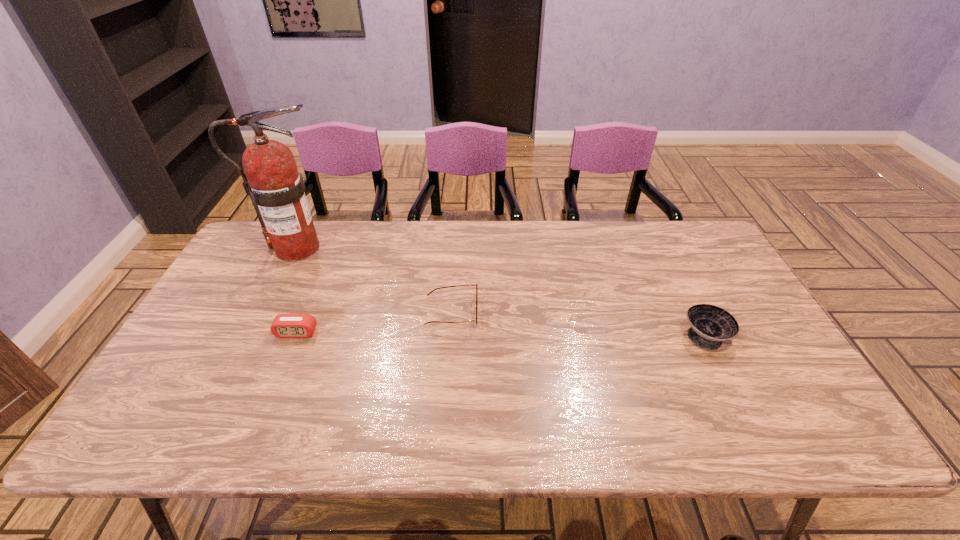
Locate an element on the screen. The image size is (960, 540). object present at the left edge is located at coordinates (277, 190).

Where is `object located at the right edge`? The height and width of the screenshot is (540, 960). object located at the right edge is located at coordinates pyautogui.click(x=710, y=325).

The width and height of the screenshot is (960, 540). Find the location of `object that is at the far left corner`. object that is at the far left corner is located at coordinates (277, 190).

Find the location of a particular element. The image size is (960, 540). free location at the far edge is located at coordinates (379, 247).

This screenshot has height=540, width=960. What are the coordinates of `free location at the near edge` in the screenshot? It's located at (206, 436).

You are a GUI agent. You are given a task and a screenshot of the screen. Output one action in this format:
    pyautogui.click(x=<x>, y=<y>)
    Task: Click on the vacant space at the left edge of the desktop
    This screenshot has width=960, height=540.
    Given the screenshot: What is the action you would take?
    pyautogui.click(x=195, y=322)

Where is `vacant space at the far right corner of the desktop`? vacant space at the far right corner of the desktop is located at coordinates point(702,251).

Identify the location of unoccupied area between the bowl and the alarm clock. The image size is (960, 540). (501, 334).

Identify the location of free space between the tallest object and the spectacles. (374, 281).

I want to click on blank region between the fire extinguisher and the bowl, so click(x=501, y=292).